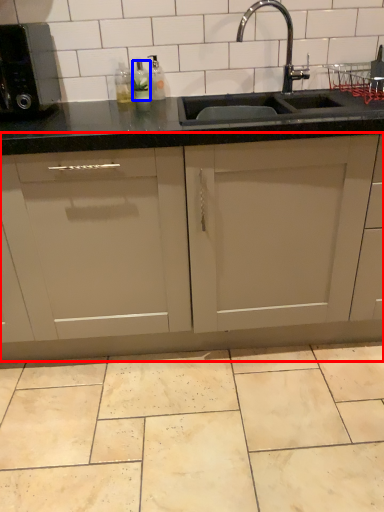
Question: Among these objects, which one is nearest to the camera, cabinetry (highlighted by a red box) or bottle (highlighted by a blue box)?

Choices:
 (A) cabinetry
 (B) bottle

Answer: (A)